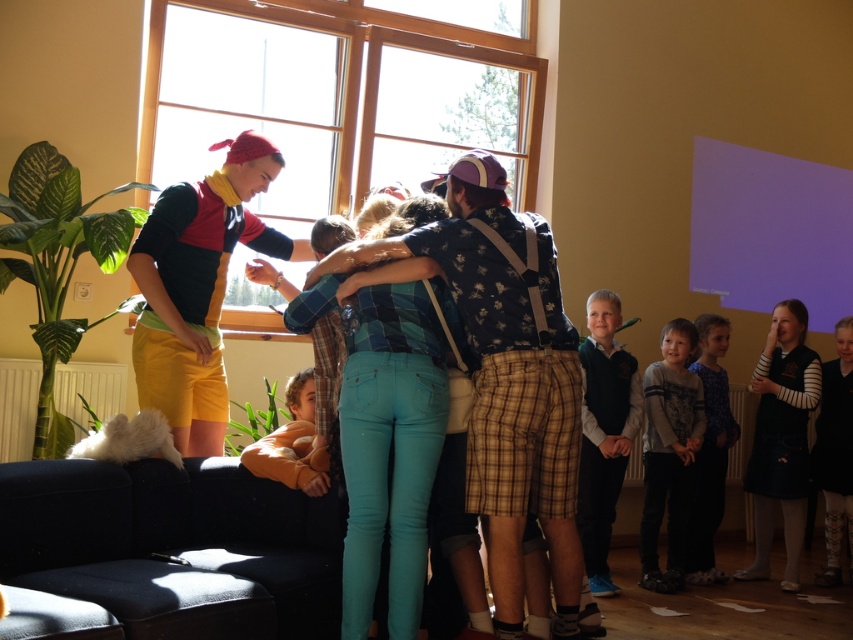
Question: Does blue denim jeans at center appear on the left side of black wool sweater at right?

Choices:
 (A) no
 (B) yes

Answer: (B)

Question: Which point is farther to the camera?

Choices:
 (A) (352, 401)
 (B) (695, 320)
 (C) (596, 388)

Answer: (B)

Question: Which is nearer to the black wool sweater at right?

Choices:
 (A) blue denim jeans at center
 (B) gray fleece sweater at lower right
 (C) dark blue dress at right
 (D) matte yellow shorts at left

Answer: (C)

Question: Does blue denim jeans at center have a greater width compared to orange plush toy at lower left?

Choices:
 (A) no
 (B) yes

Answer: (B)

Question: Based on their relative distances, which object is nearer to the black wool sweater at right?

Choices:
 (A) matte yellow shorts at left
 (B) dark blue sweater at lower right

Answer: (B)

Question: Can you confirm if dark blue dress at right is bigger than gray fleece sweater at lower right?

Choices:
 (A) yes
 (B) no

Answer: (A)